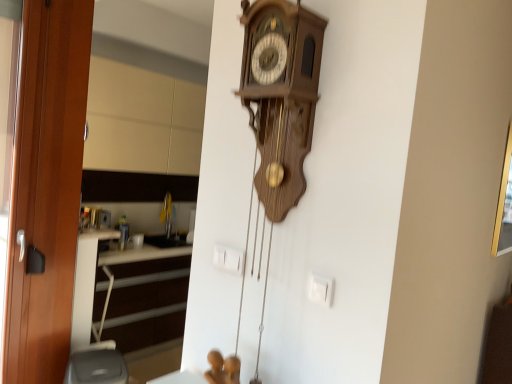
Question: Based on their sizes in the image, would you say beige matte cabinet at upper left is bigger or smaller than gold metallic picture frame at upper right?

Choices:
 (A) small
 (B) big

Answer: (B)

Question: From their relative heights in the image, would you say beige matte cabinet at upper left is taller or shorter than gold metallic picture frame at upper right?

Choices:
 (A) tall
 (B) short

Answer: (A)

Question: Estimate the real-world distances between objects in this image. Which object is farther from the gold metallic picture frame at upper right?

Choices:
 (A) wooden door at left
 (B) white plastic electric outlet at center
 (C) beige matte cabinet at upper left

Answer: (C)

Question: Based on their relative distances, which object is farther from the wooden door at left?

Choices:
 (A) white plastic electric outlet at center
 (B) gold metallic picture frame at upper right
 (C) beige matte cabinet at upper left

Answer: (B)